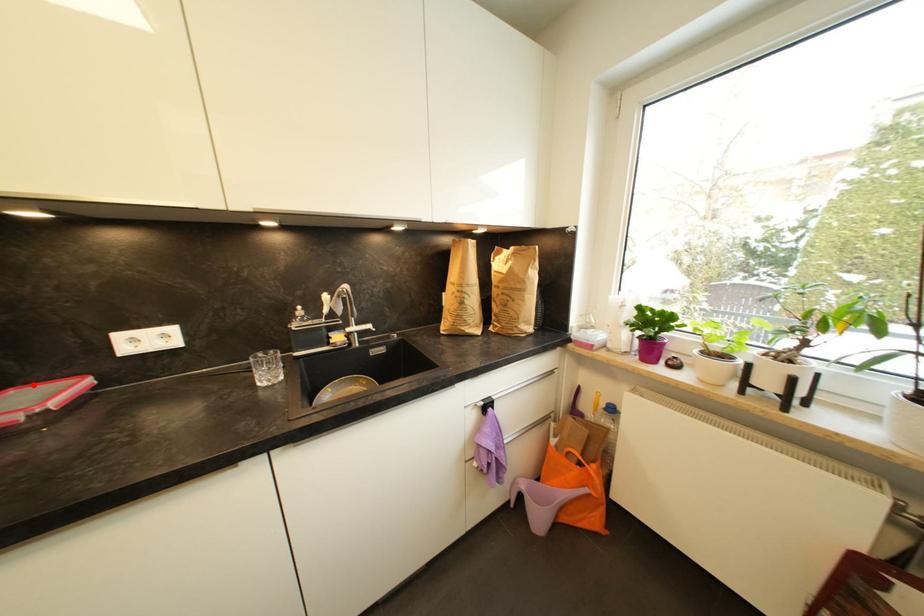
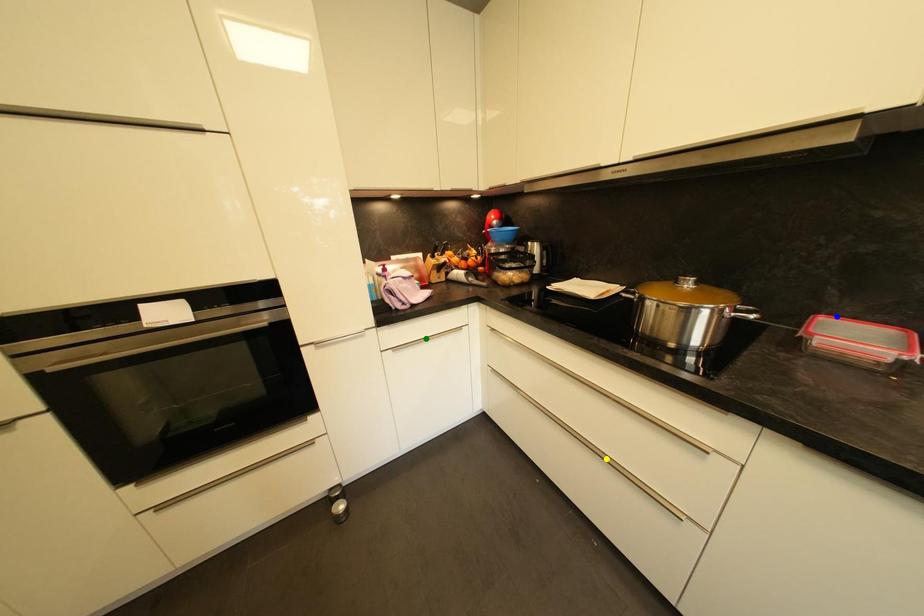
Question: I am providing you with two images of the same scene from different viewpoints. A red point is marked on the first image. You are given multiple points on the second image. Can you choose the point in image 2 that corresponds to the point in image 1?

Choices:
 (A) green point
 (B) blue point
 (C) yellow point

Answer: (B)